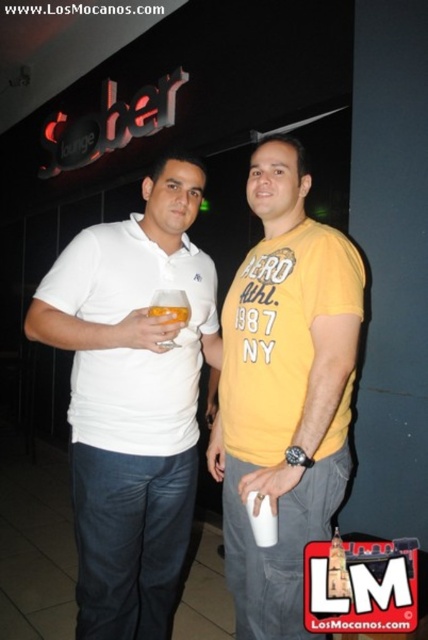
Does white matte polo shirt at center appear on the right side of translucent glass at center?

Incorrect, white matte polo shirt at center is not on the right side of translucent glass at center.

Which of these two, white matte polo shirt at center or translucent glass at center, stands shorter?

translucent glass at center is shorter.

The height and width of the screenshot is (640, 428). Describe the element at coordinates (133, 401) in the screenshot. I see `white matte polo shirt at center` at that location.

You are a GUI agent. You are given a task and a screenshot of the screen. Output one action in this format:
    pyautogui.click(x=<x>, y=<y>)
    Task: Click on the white matte polo shirt at center
    
    Given the screenshot: What is the action you would take?
    pyautogui.click(x=133, y=401)

Consider the image. Does white cotton polo shirt at left have a smaller size compared to translucent glass at center?

No.

Is white cotton polo shirt at left positioned at the back of translucent glass at center?

Yes, white cotton polo shirt at left is further from the viewer.

Between point (202, 332) and point (181, 317), which one is positioned behind?

The point (202, 332) is behind.

The height and width of the screenshot is (640, 428). Identify the location of white cotton polo shirt at left. (133, 348).

Who is more distant from viewer, (294, 353) or (89, 273)?

Positioned behind is point (89, 273).

Based on the photo, which is more to the left, yellow cotton t-shirt at center or white cotton polo shirt at left?

From the viewer's perspective, white cotton polo shirt at left appears more on the left side.

Where is `yellow cotton t-shirt at center`? The height and width of the screenshot is (640, 428). yellow cotton t-shirt at center is located at coordinates (284, 392).